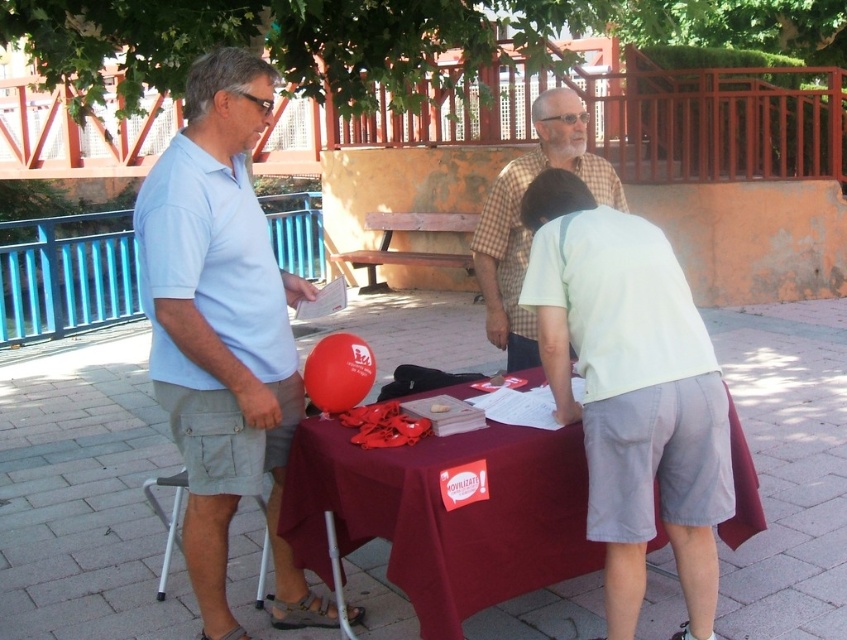
In the scene shown: You are standing at the entrance of the plaza and want to find the maroon fabric table at center. According to the coordinates provided, in which direction should you walk to reach it?

The maroon fabric table at center is located at coordinates point (x=444, y=515). Since the coordinate system typically places the origin at the bottom left corner, a higher x value means moving to the right and a higher y value means moving upwards. Therefore, to reach the maroon fabric table at center, you should walk towards the right and slightly forward from the entrance.

Looking at this image, you are a photographer positioned at the railing in the background. You want to take a photo of the maroon fabric table at center and the light gray plastic stool at lower left. From your current position, which object will appear closer to the camera in the photo?

The maroon fabric table at center will appear closer to the camera in the photo because it is positioned in front of the light gray plastic stool at lower left.

You are standing in the plaza and want to place a new item on the maroon fabric table at center. The table has coordinates from 0.7 to 0.9 on the x axis and 0.45 to 0.55 on the y axis. Is the point (444, 515) on the table?

The point (444, 515) is on the maroon fabric table at center, so yes, the point is on the table.